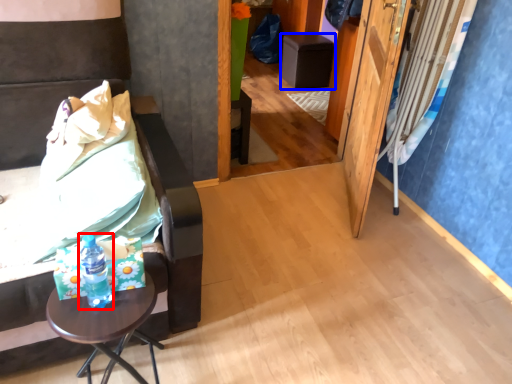
Question: Among these objects, which one is farthest to the camera, bottle (highlighted by a red box) or furniture (highlighted by a blue box)?

Choices:
 (A) bottle
 (B) furniture

Answer: (B)